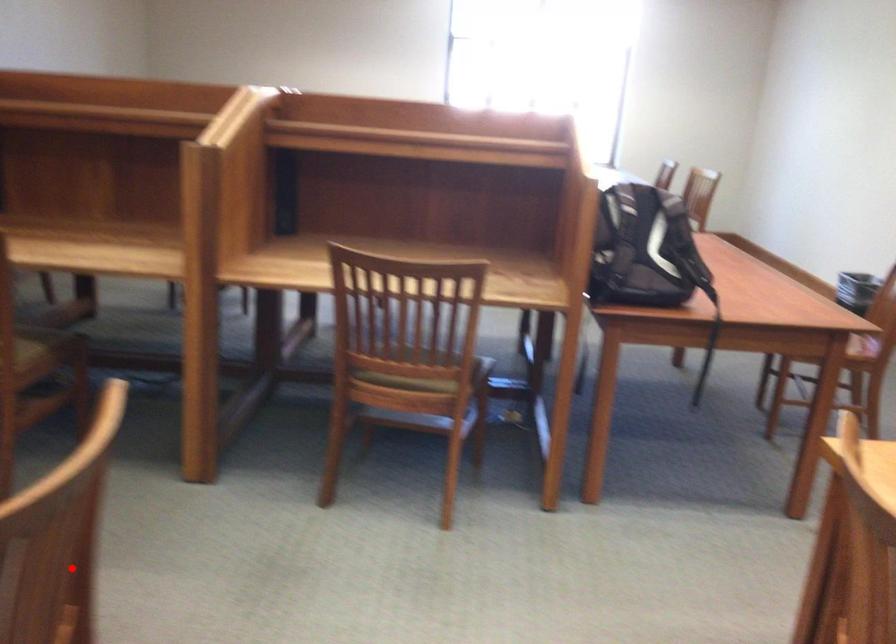
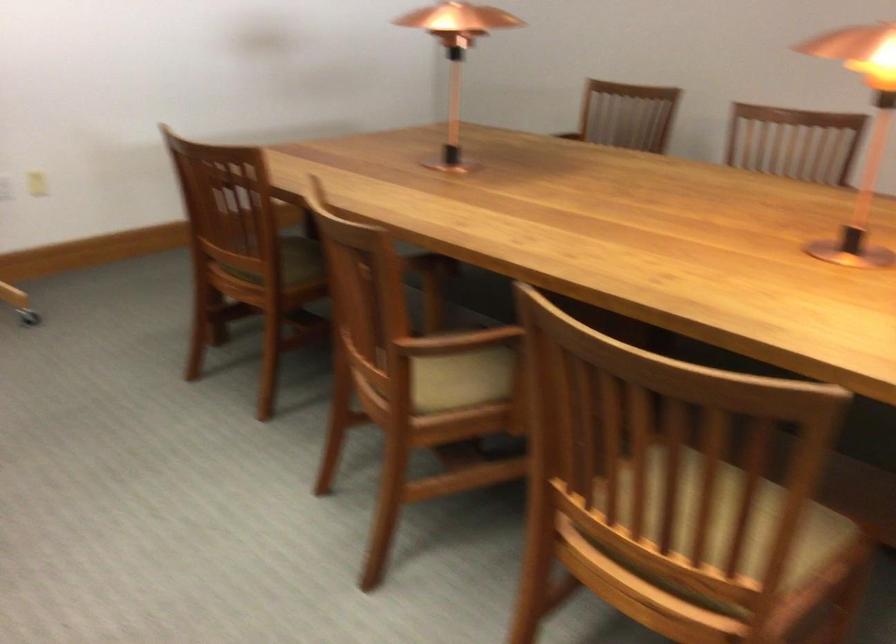
Locate, in the second image, the point that corresponds to the highlighted location in the first image.

(728, 526)